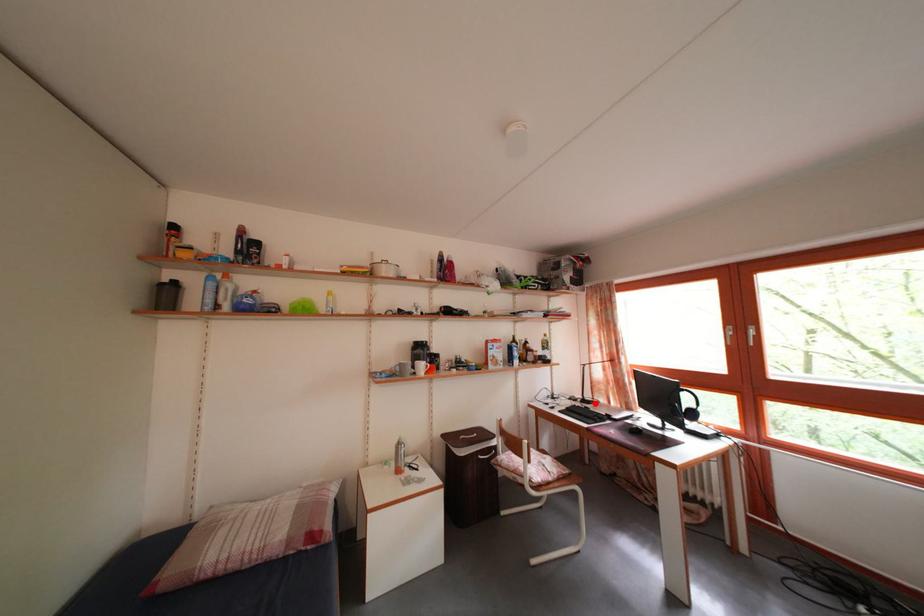
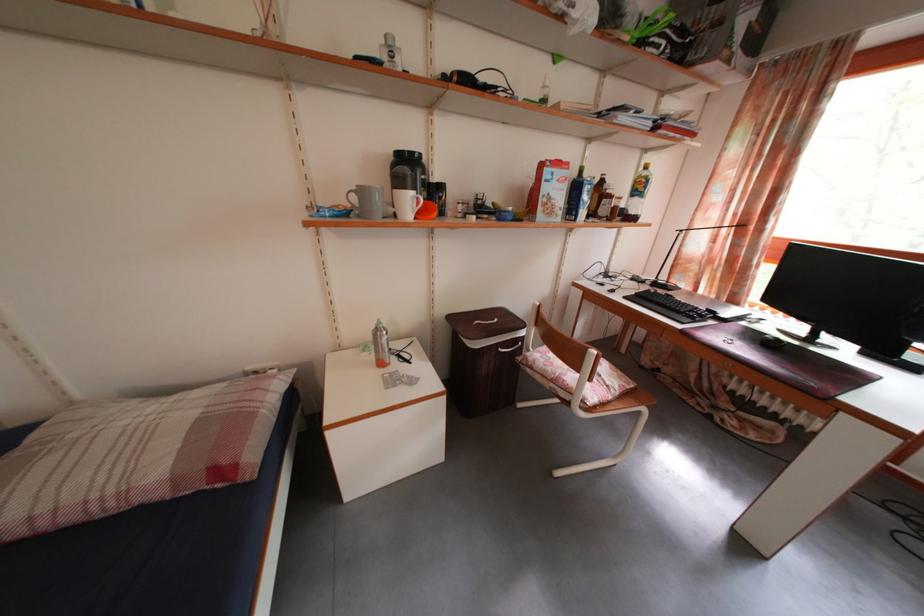
In the second image, find the point that corresponds to the highlighted location in the first image.

(671, 285)